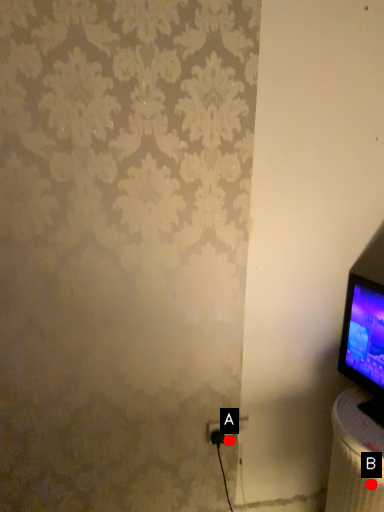
Question: Two points are circled on the image, labeled by A and B beside each circle. Which point is further to the camera?

Choices:
 (A) A is further
 (B) B is further

Answer: (A)